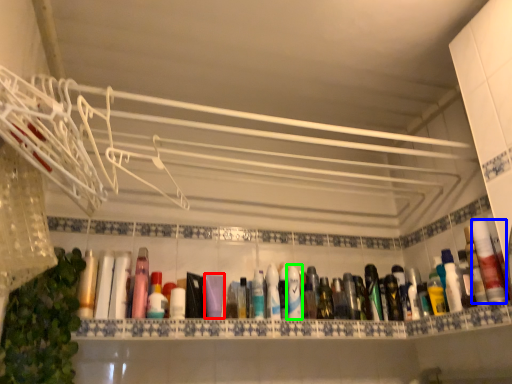
Question: Which object is the farthest from mouthwash (highlighted by a red box)? Choose among these: mouthwash (highlighted by a blue box) or mouthwash (highlighted by a green box).

Choices:
 (A) mouthwash
 (B) mouthwash

Answer: (A)